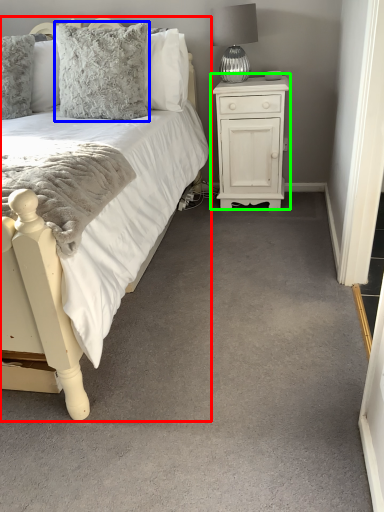
Question: Which is farther away from bed (highlighted by a red box)? pillow (highlighted by a blue box) or nightstand (highlighted by a green box)?

Choices:
 (A) pillow
 (B) nightstand

Answer: (B)